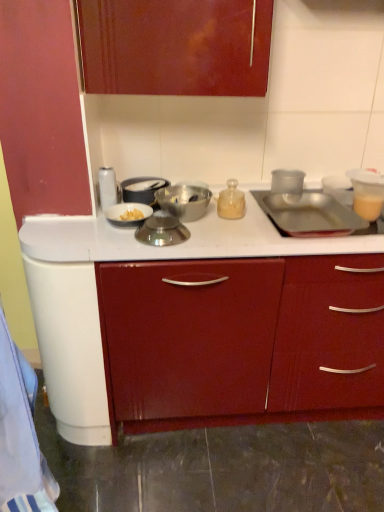
The image size is (384, 512). Find the location of `blank space situated above shiny metallic bowl at center, which ranks as the 4th kitchen appliance in right-to-left order (from a real-world perspective)`. blank space situated above shiny metallic bowl at center, which ranks as the 4th kitchen appliance in right-to-left order (from a real-world perspective) is located at coordinates (163, 219).